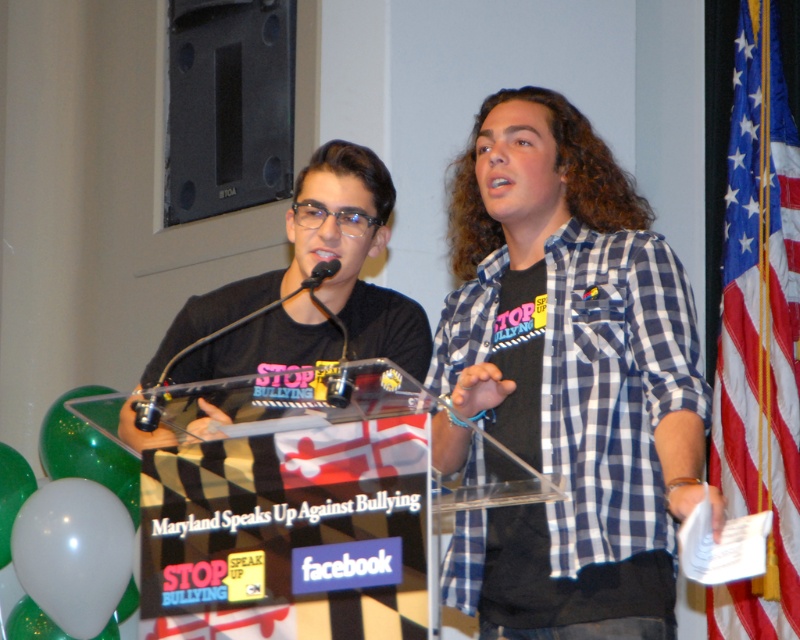
Question: Which point is closer to the camera?

Choices:
 (A) (717, 381)
 (B) (336, 268)
 (C) (520, 512)

Answer: (C)

Question: Which object is farther from the camera taking this photo?

Choices:
 (A) blue checkered shirt at center
 (B) black plastic microphone at center
 (C) american flag at right

Answer: (C)

Question: Does blue checkered shirt at center have a lesser width compared to american flag at right?

Choices:
 (A) no
 (B) yes

Answer: (A)

Question: In this image, where is blue checkered shirt at center located relative to black plastic microphone at center?

Choices:
 (A) left
 (B) right

Answer: (B)

Question: Which object is farther from the camera taking this photo?

Choices:
 (A) american flag at right
 (B) blue checkered shirt at center
 (C) black plastic microphone at center

Answer: (A)

Question: Can you confirm if blue checkered shirt at center is smaller than black plastic microphone at center?

Choices:
 (A) no
 (B) yes

Answer: (A)